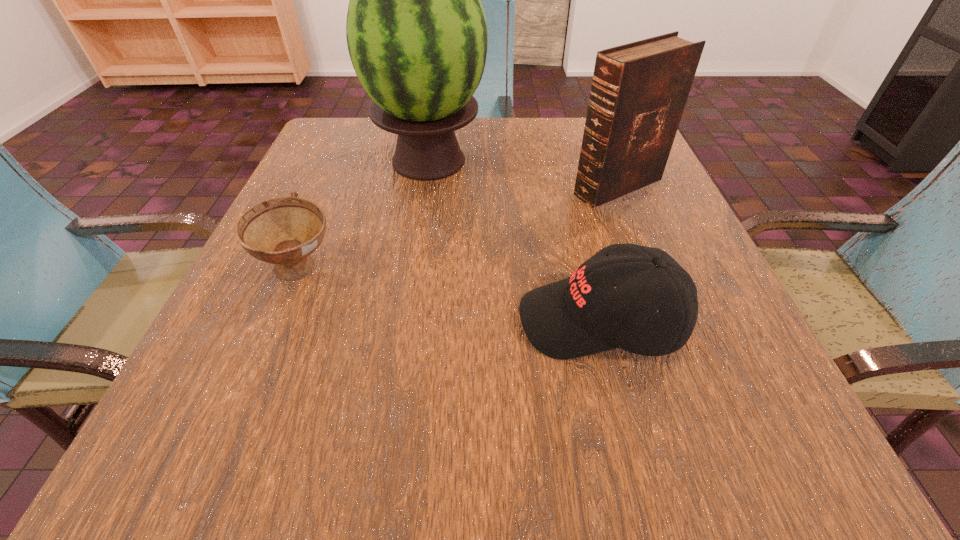
The width and height of the screenshot is (960, 540). In order to click on watermelon present at the far edge in this screenshot , I will do `click(416, 31)`.

You are a GUI agent. You are given a task and a screenshot of the screen. Output one action in this format:
    pyautogui.click(x=<x>, y=<y>)
    Task: Click on the Bible at the far edge
    This screenshot has width=960, height=540.
    Given the screenshot: What is the action you would take?
    pyautogui.click(x=639, y=90)

Find the location of a particular element. watermelon located at the left edge is located at coordinates (416, 31).

At what (x,y) coordinates should I click in order to perform the action: click on soup bowl that is positioned at the left edge. Please return your answer as a coordinate pair (x, y). Looking at the image, I should click on (284, 231).

I want to click on Bible that is at the right edge, so click(x=639, y=90).

Identify the location of baseball cap that is at the right edge. Image resolution: width=960 pixels, height=540 pixels. (581, 315).

Locate an element on the screen. The image size is (960, 540). object that is positioned at the far left corner is located at coordinates (416, 31).

Where is `object located at the far right corner`? The width and height of the screenshot is (960, 540). object located at the far right corner is located at coordinates [x=639, y=90].

Image resolution: width=960 pixels, height=540 pixels. Find the location of `vacant region at the far edge of the desktop`. vacant region at the far edge of the desktop is located at coordinates (574, 148).

Identify the location of free region at the near edge. The width and height of the screenshot is (960, 540). (411, 471).